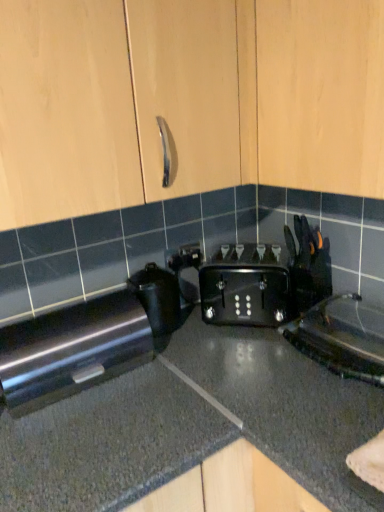
The height and width of the screenshot is (512, 384). In order to click on vacant area located to the right-hand side of black plastic toaster at center, which ranks as the first appliance in left-to-right order in this screenshot , I will do `click(205, 334)`.